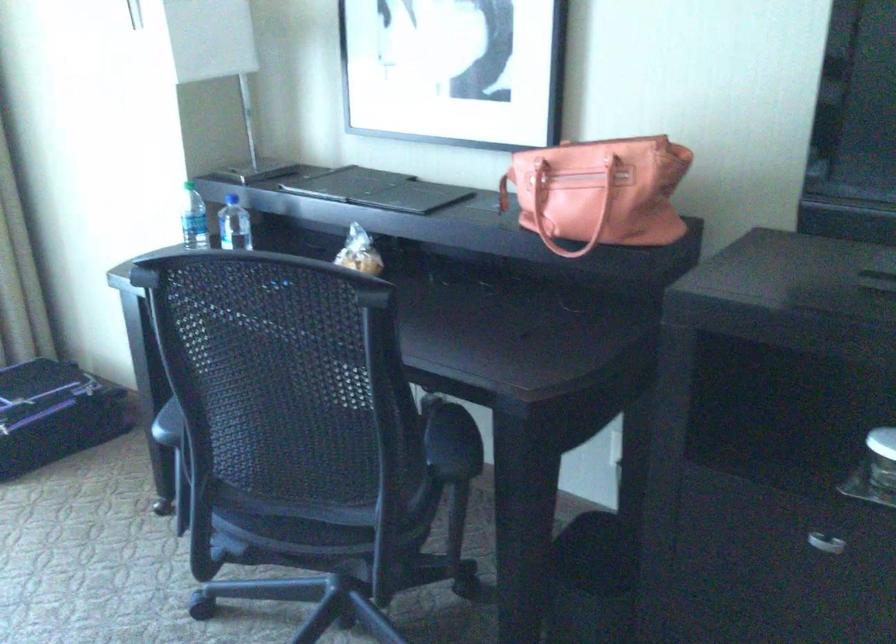
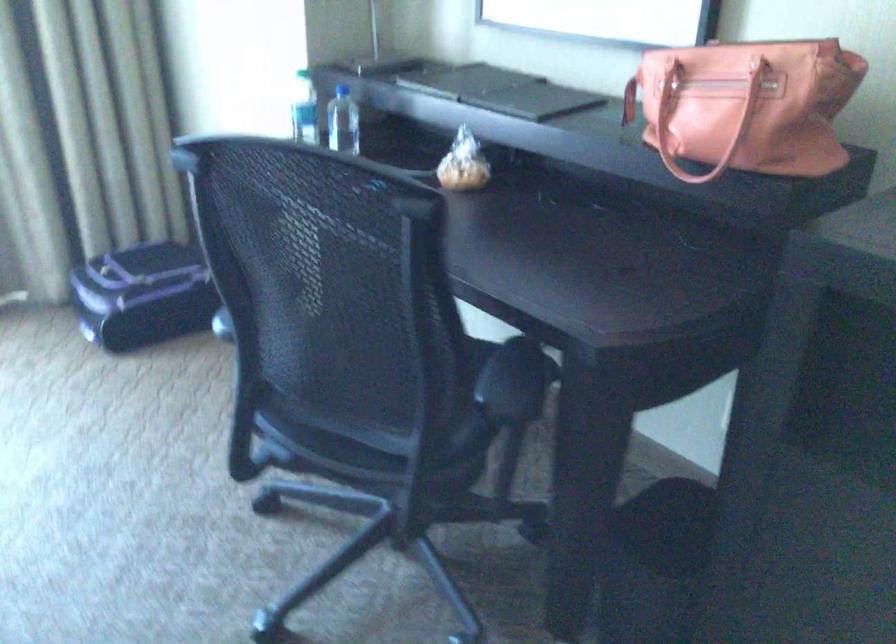
Question: The images are taken continuously from a first-person perspective. In which direction is your viewpoint rotating?

Choices:
 (A) Left
 (B) Right
 (C) Up
 (D) Down

Answer: (A)